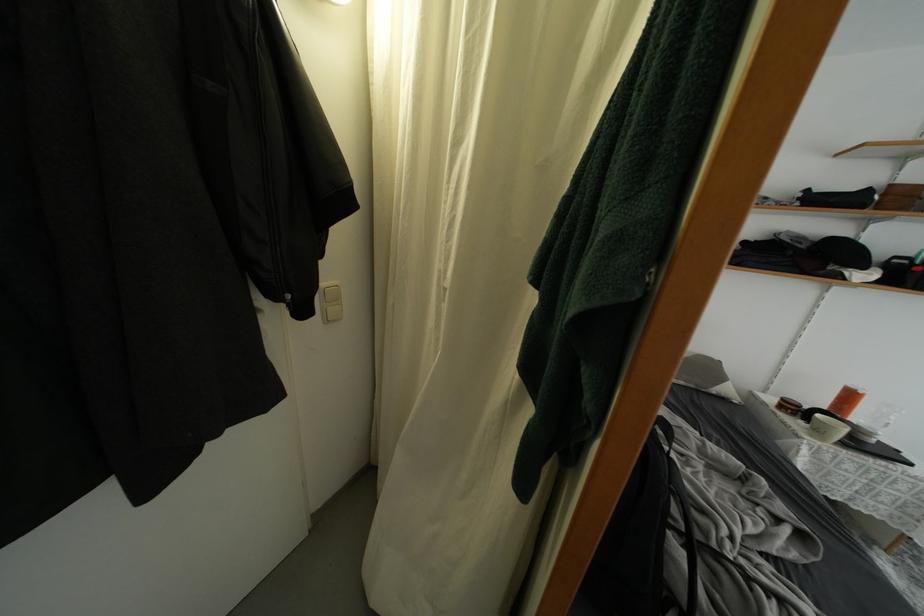
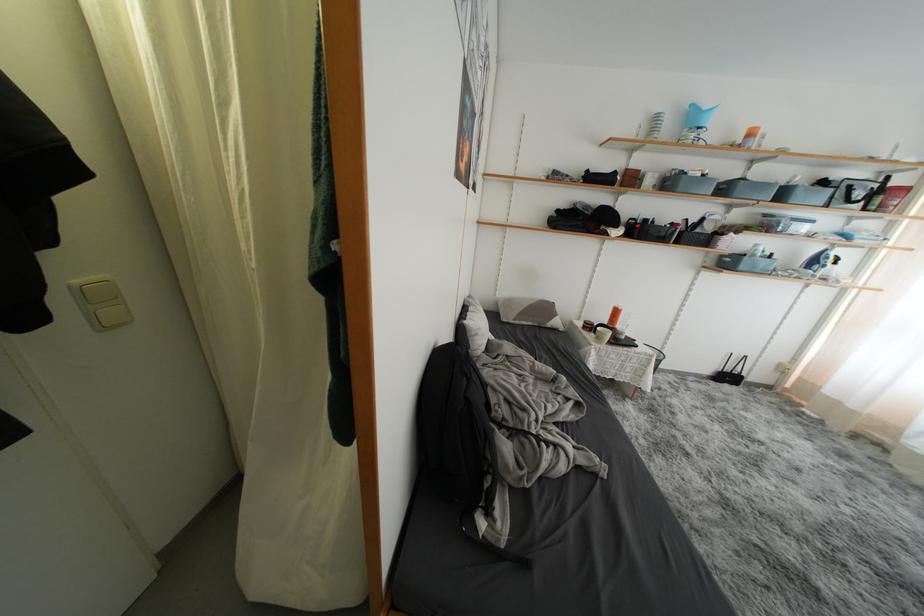
Question: How did the camera likely rotate?

Choices:
 (A) Left
 (B) Right
 (C) Up
 (D) Down

Answer: (B)